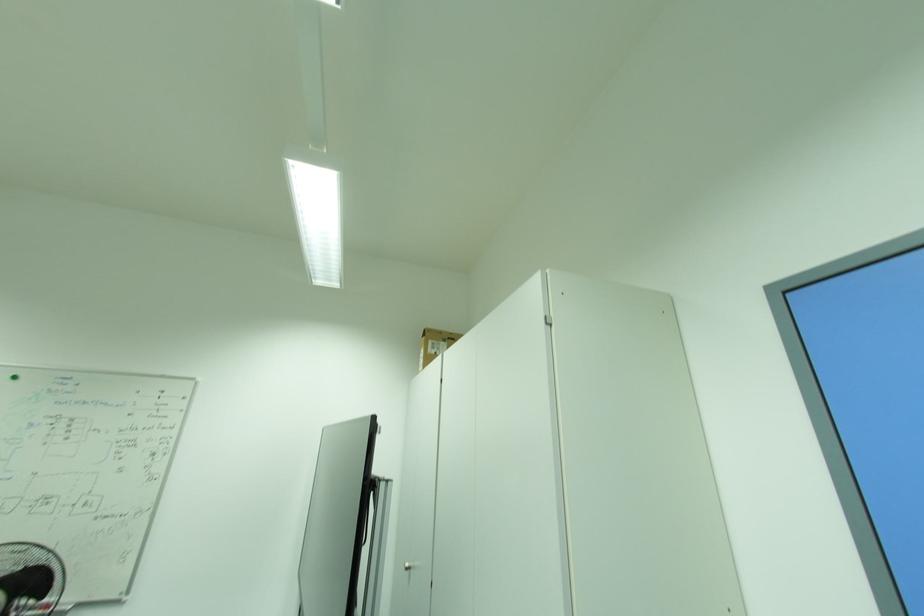
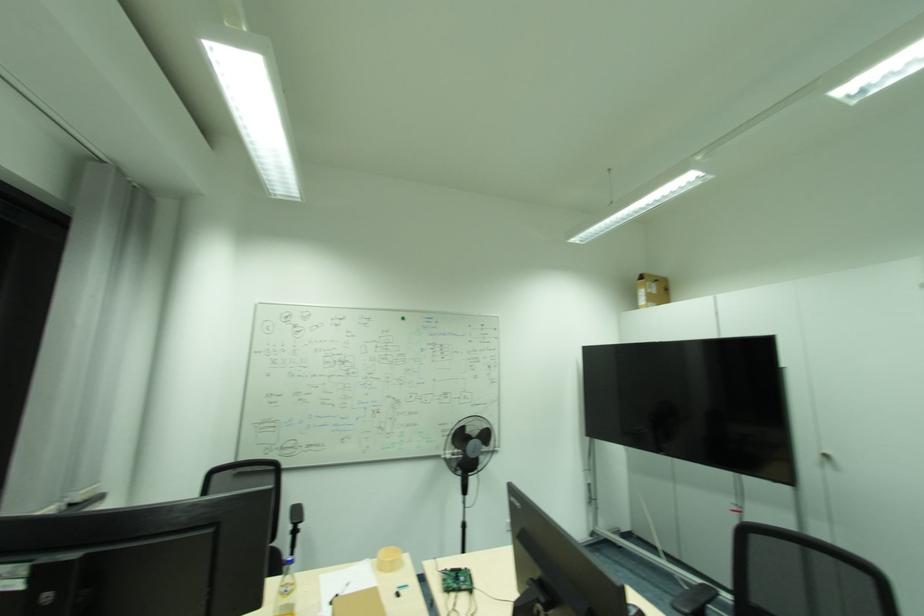
Question: I am providing you with two images of the same scene from different viewpoints. Which of the following objects are not visible in image2?

Choices:
 (A) cardboard box
 (B) blue barrel lid
 (C) silver cabinet handle
 (D) glass bottle

Answer: (C)